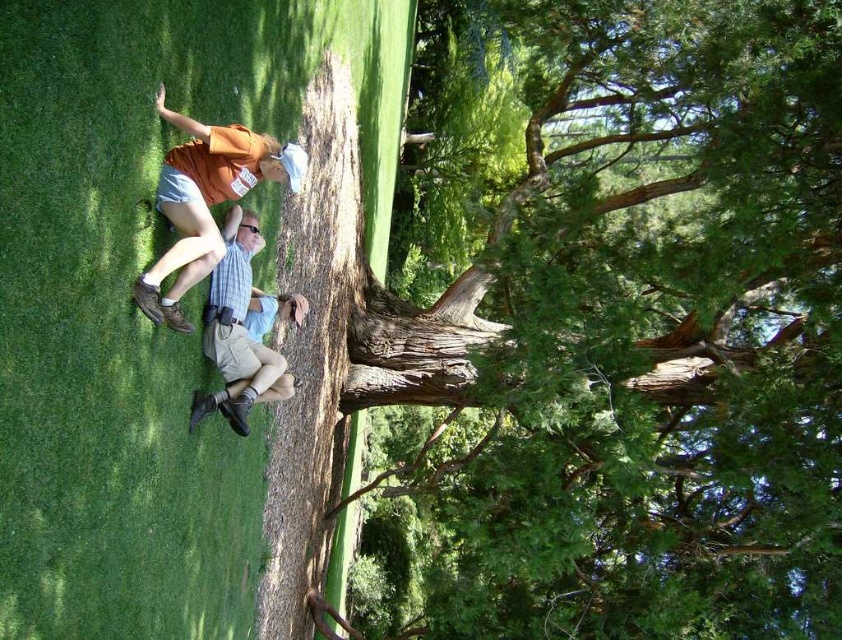
You are planning to take a photo of the orange cotton shirt at upper left and the green textured tree at center. Which object should you focus on first if you want to capture both in the same frame without moving the camera?

You should focus on the orange cotton shirt at upper left first because the green textured tree at center is positioned over it, meaning the tree is closer to the camera. By focusing on the closer object, you can ensure both are in focus within the depth of field.

You are standing in the park and see two points in the image. Which point is nearer to you, point (272, 168) or point (216, 282)?

Point (272, 168) is closer to the viewer than point (216, 282).

You are planning to take a photo of the green textured tree at center and the light blue denim shorts at center. Based on their sizes, which object should you focus on first to ensure both are clearly visible in the frame?

The green textured tree at center is wider than the light blue denim shorts at center, so you should focus on the green textured tree at center first to ensure its full width is captured clearly in the frame.